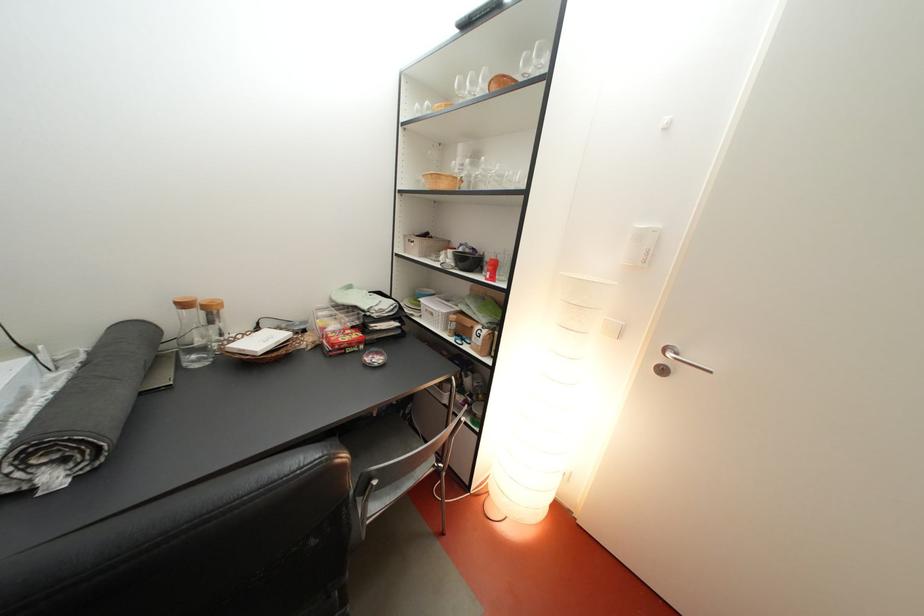
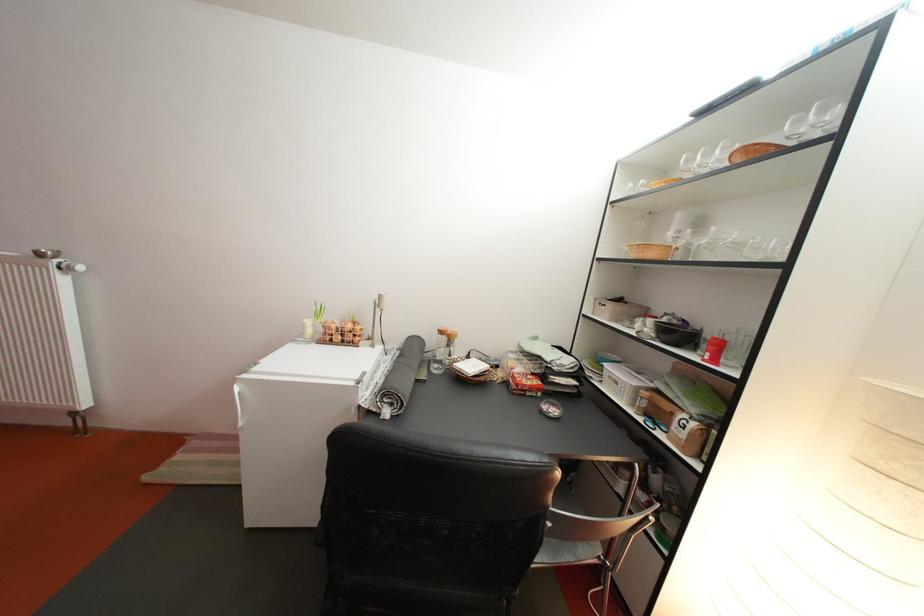
In the second image, find the point that corresponds to (x=471, y=256) in the first image.

(675, 326)